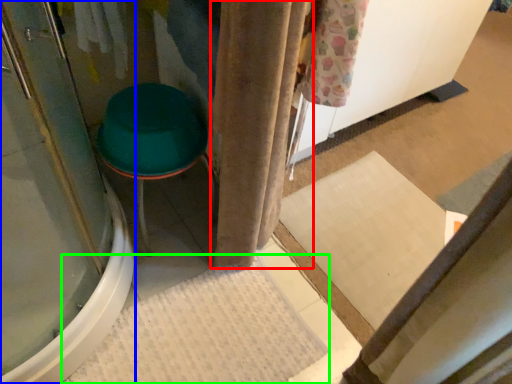
Question: Considering the real-world distances, which object is closest to curtain (highlighted by a red box)? screen door (highlighted by a blue box) or bath mat (highlighted by a green box).

Choices:
 (A) screen door
 (B) bath mat

Answer: (B)